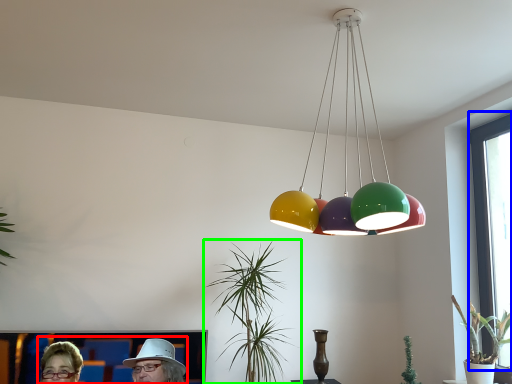
Question: Based on their relative distances, which object is farther from couple (highlighted by a red box)? Choose from window screen (highlighted by a blue box) and houseplant (highlighted by a green box).

Choices:
 (A) window screen
 (B) houseplant

Answer: (A)